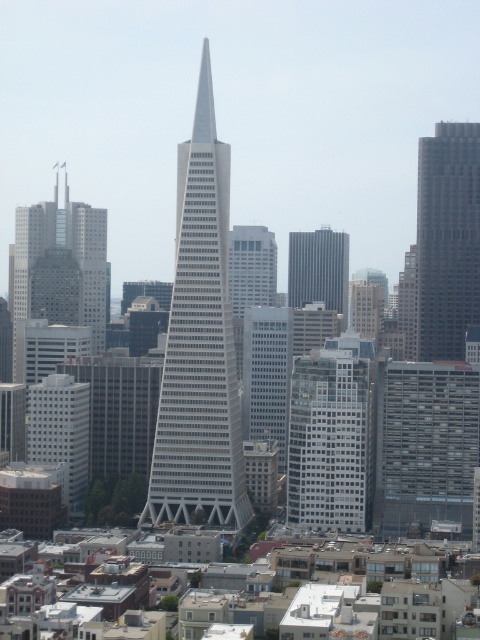
Based on the photo, you are standing at the base of the white glass skyscraper at center, and you want to throw a ball to a friend who is 646.23 meters away from you. Can you reach them by throwing the ball?

The distance between you and your friend is exactly 646.23 meters. However, the maximum throwing distance for a typical human is around 100 meters. Therefore, you cannot reach your friend by throwing the ball that far.

You are a drone operator tasked with flying a drone between the white glass building at center and the matte glass skyscraper at left. The drone has a safety requirement that it must maintain a minimum distance of 50 meters from any building. Can the drone safely fly between these two structures?

The distance between the white glass building at center and the matte glass skyscraper at left is 85.96 meters. Since the drone requires a minimum of 50 meters clearance, the 85.96 meters distance is sufficient for safe passage between the two buildings.